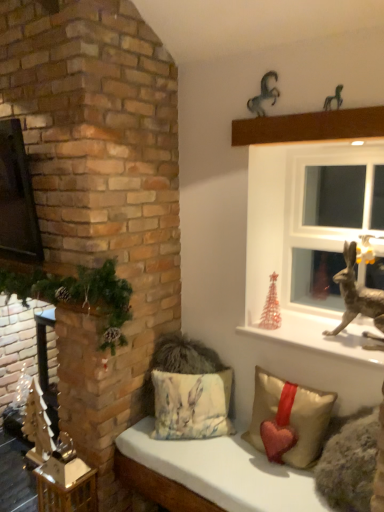
This screenshot has height=512, width=384. Identify the location of vacant space behind translucent glass christmas tree at right, which ranks as the first christmas decoration in right-to-left order. (272, 320).